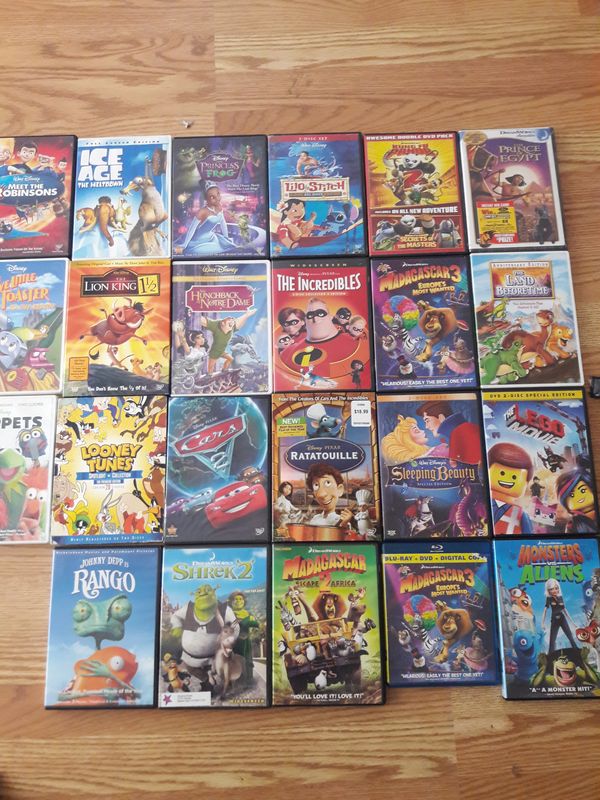
The width and height of the screenshot is (600, 800). Identify the location of dvd in top row. (44, 193), (100, 201), (197, 210), (292, 212), (407, 210), (491, 210).